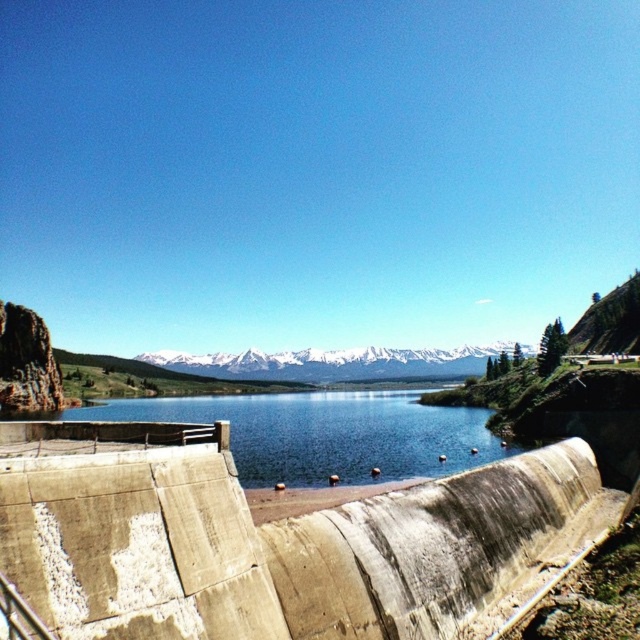
Question: Considering the real-world distances, which object is closest to the blue concrete water at center?

Choices:
 (A) concrete dam at lower center
 (B) white snow-covered mountain at center

Answer: (A)

Question: Estimate the real-world distances between objects in this image. Which object is farther from the concrete dam at lower center?

Choices:
 (A) white snow-covered mountain at center
 (B) blue concrete water at center

Answer: (A)

Question: Does blue concrete water at center have a larger size compared to white snow-covered mountain at center?

Choices:
 (A) no
 (B) yes

Answer: (A)

Question: Which point appears farthest from the camera in this image?

Choices:
 (A) (314, 467)
 (B) (296, 372)

Answer: (B)

Question: Is concrete dam at lower center bigger than white snow-covered mountain at center?

Choices:
 (A) no
 (B) yes

Answer: (A)

Question: Can you confirm if concrete dam at lower center is thinner than blue concrete water at center?

Choices:
 (A) no
 (B) yes

Answer: (B)